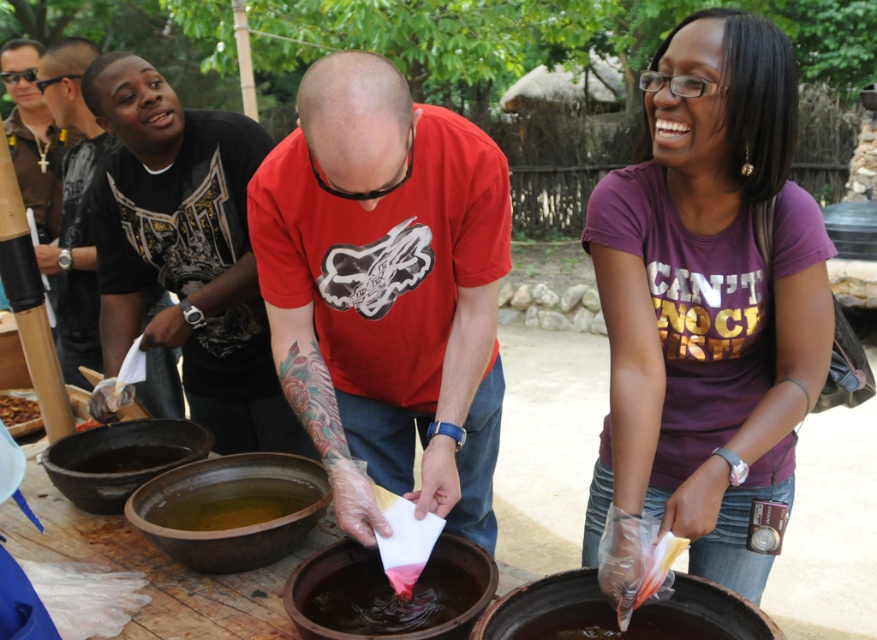
You are a photographer standing in front of the scene. You want to capture a photo where the yellowish liquid at center and the dark brown clay pot at lower left are both clearly visible. Which object should you focus on first to ensure both are in sharp focus?

The yellowish liquid at center is closer to the viewer than the dark brown clay pot at lower left. To ensure both are in sharp focus, focus on the yellowish liquid at center first, as it is the closer object.

You are standing at the origin point of the coordinate system in the image. You want to walk to the purple cotton shirt at center. Which direction should you go?

The purple cotton shirt at center is located at coordinate point 0.466 on the x axis and 0.808 on the y axis. Since you are at the origin point, you should move towards the positive x and positive y direction to reach the purple cotton shirt at center.

You are a photographer trying to capture the scene. You want to frame the purple cotton shirt at center and dark brown clay pot at lower center in your shot. Which object should you focus on first if you want to ensure both are in the frame without moving the camera?

The purple cotton shirt at center is wider than the dark brown clay pot at lower center. To ensure both are in the frame, focus on the wider object first, which is the purple cotton shirt at center, then adjust the framing to include the smaller dark brown clay pot at lower center.